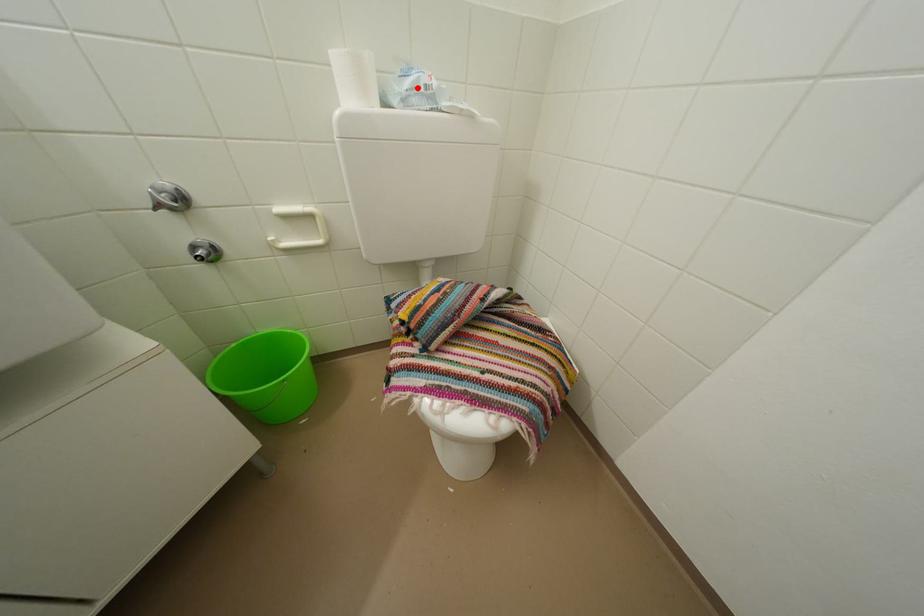
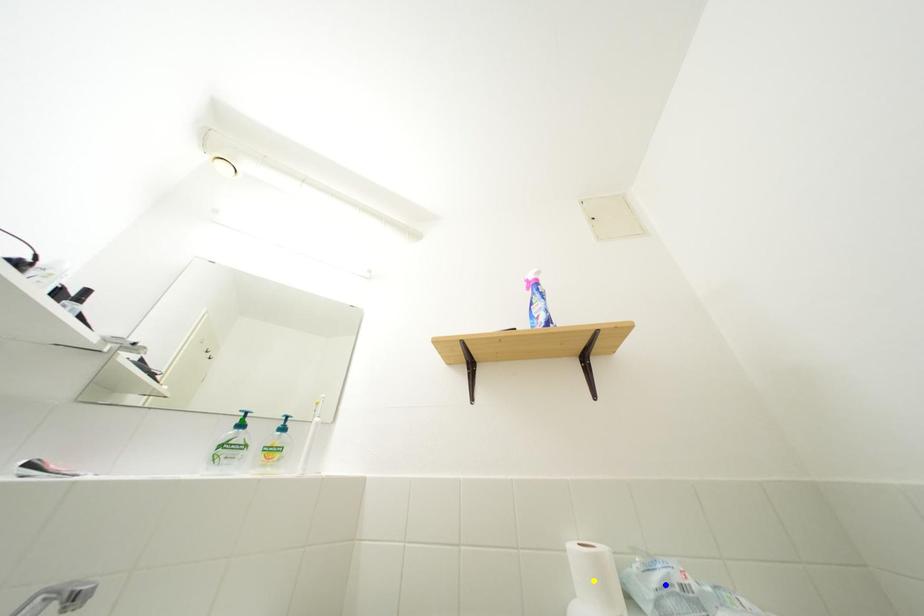
Question: I am providing you with two images of the same scene from different viewpoints. A red point is marked on the first image. You are given multiple points on the second image. Which spot in image 2 lines up with the point in image 1?

Choices:
 (A) blue point
 (B) green point
 (C) yellow point

Answer: (A)